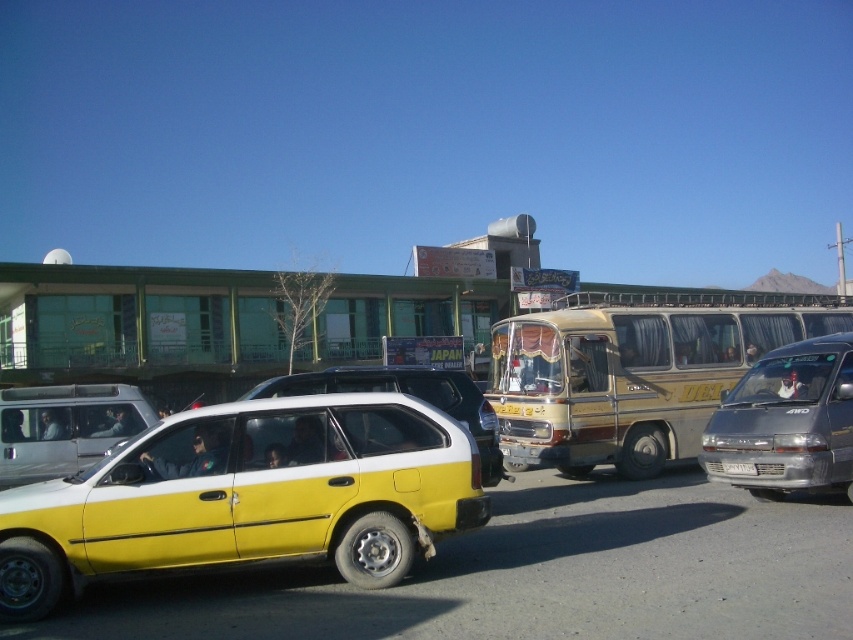
Consider the image. You are a delivery driver who needs to park your vehicle in a spot that can accommodate both your metallic silver van at center and a white plastic license plate at center. Based on the scene, will there be enough space if you place them side by side?

The metallic silver van at center is larger in size than the white plastic license plate at center, so there should be enough space to park them side by side as long as the total width required does not exceed the available parking space.

You are a delivery person trying to park your vehicle in a narrow parking spot. You see the yellow matte hatchback at lower left and the white plastic license plate at center in the image. Which vehicle part is taller?

The yellow matte hatchback at lower left is much taller than the white plastic license plate at center.